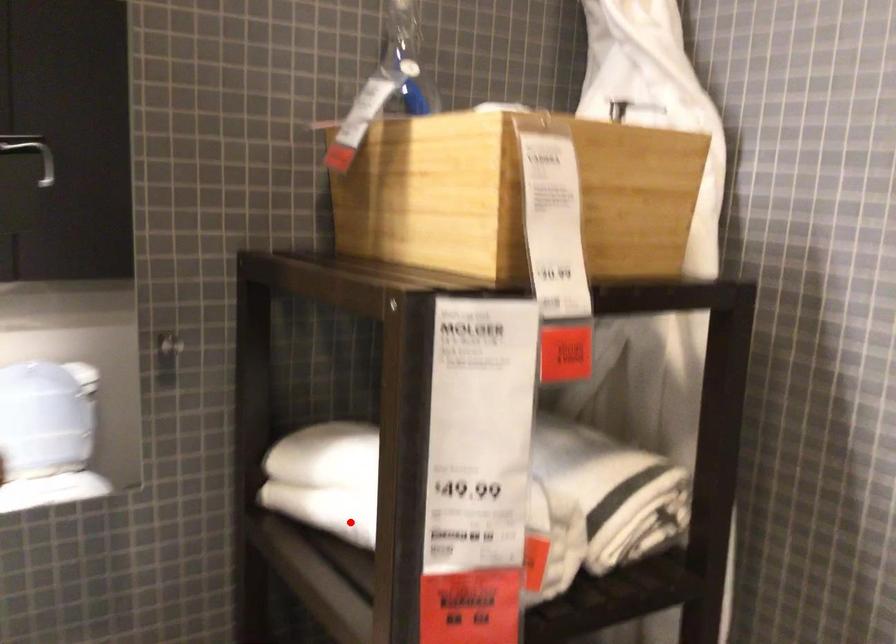
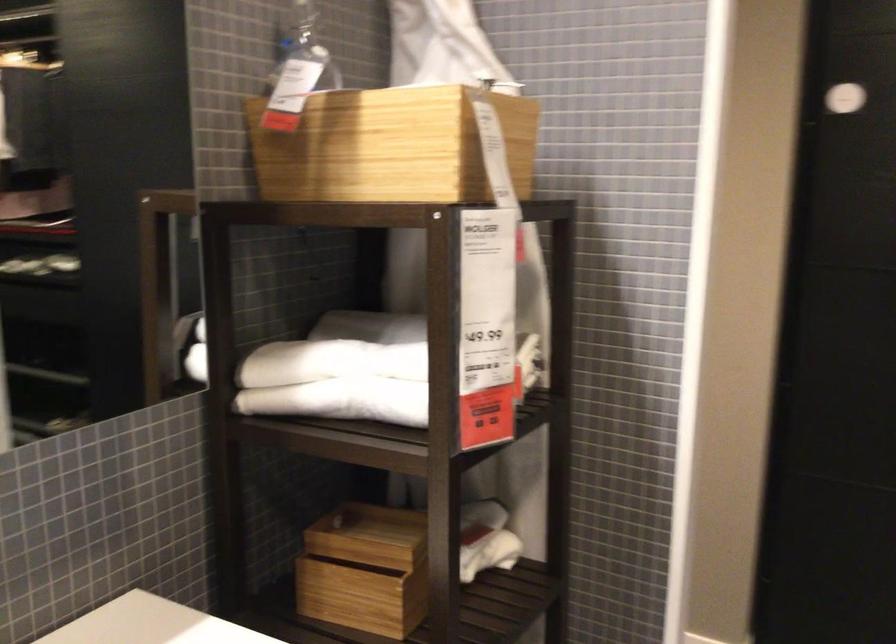
The point at the highlighted location is marked in the first image. Where is the corresponding point in the second image?

(341, 401)